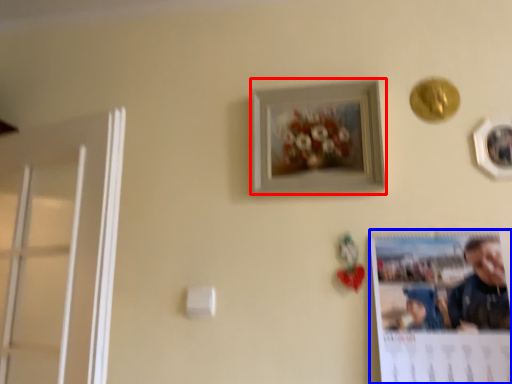
Question: Which of the following is the farthest to the observer, picture frame (highlighted by a red box) or poster page (highlighted by a blue box)?

Choices:
 (A) picture frame
 (B) poster page

Answer: (A)